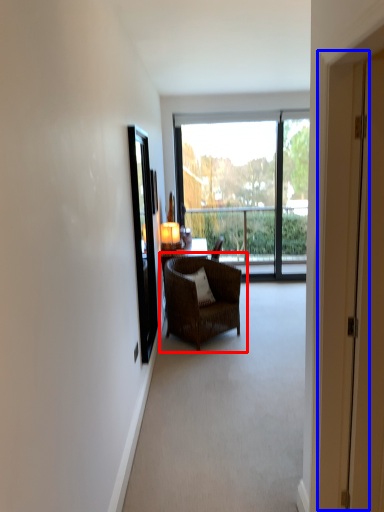
Question: Which point is closer to the camera, chair (highlighted by a red box) or screen door (highlighted by a blue box)?

Choices:
 (A) chair
 (B) screen door

Answer: (B)